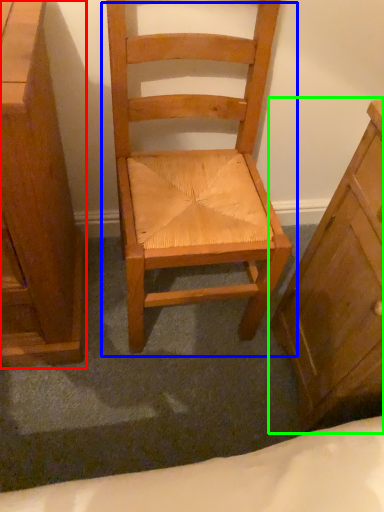
Question: Which object is positioned closest to chest of drawers (highlighted by a red box)? Select from chair (highlighted by a blue box) and chest of drawers (highlighted by a green box).

Choices:
 (A) chair
 (B) chest of drawers

Answer: (A)